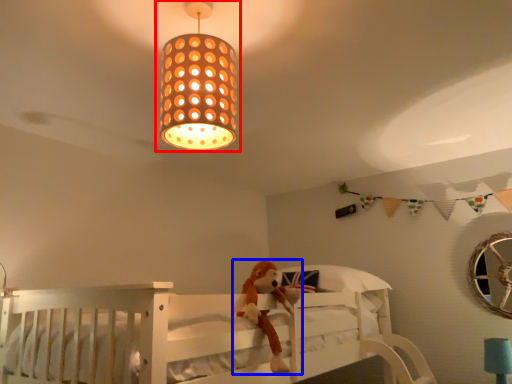
Question: Among these objects, which one is farthest to the camera, lamp (highlighted by a red box) or toy (highlighted by a blue box)?

Choices:
 (A) lamp
 (B) toy

Answer: (B)